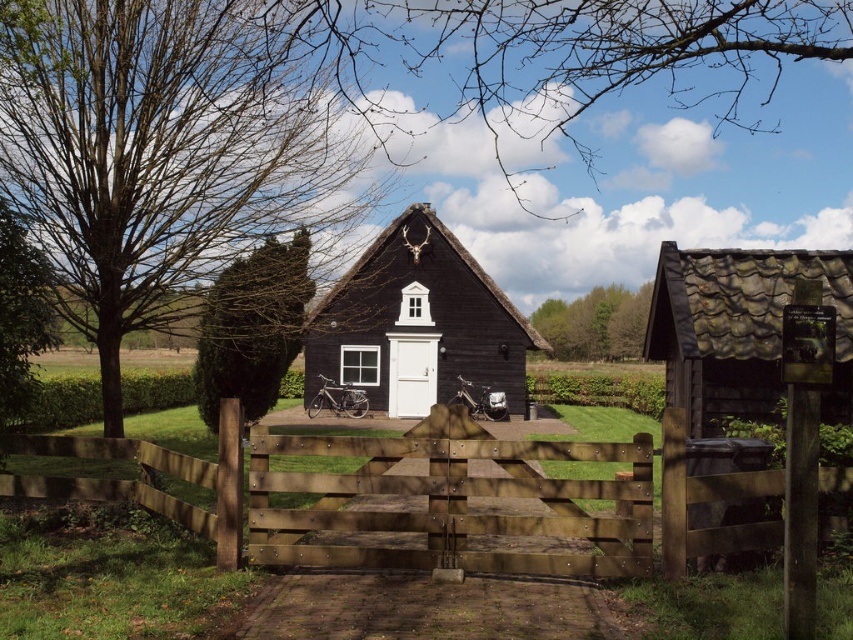
Question: Which point is farther from the camera taking this photo?

Choices:
 (A) (268, 316)
 (B) (628, 292)
 (C) (387, 280)

Answer: (B)

Question: Can you confirm if matte black cottage at center is smaller than green leafy trees at center?

Choices:
 (A) no
 (B) yes

Answer: (B)

Question: Does rustic brown hut at right appear under green leafy bush at center?

Choices:
 (A) yes
 (B) no

Answer: (A)

Question: Which point is farther from the camera taking this photo?

Choices:
 (A) coord(630,298)
 (B) coord(694,298)
 (C) coord(500,326)

Answer: (A)

Question: Does brown wooden gate at center have a lesser width compared to green leafy bush at center?

Choices:
 (A) no
 (B) yes

Answer: (A)

Question: Considering the real-world distances, which object is farthest from the brown wooden gate at center?

Choices:
 (A) rustic brown hut at right
 (B) matte black cottage at center
 (C) green leafy trees at center

Answer: (C)